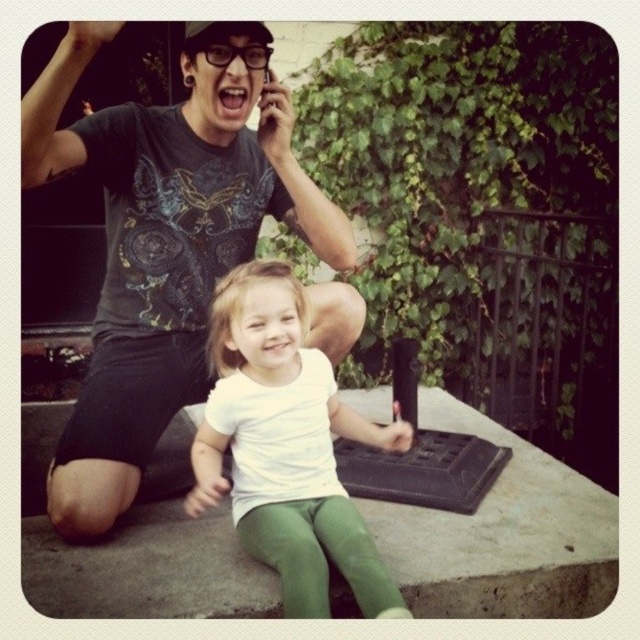
You are a photographer trying to capture a candid shot of the scene. You notice the green fabric at lower center and the white matte shirt at center. Which object should you focus on if you want to capture the subject that is positioned to the right side of the other?

The green fabric at lower center should be focused on because it is positioned to the right of the white matte shirt at center.

You are standing in a park and see a person on the left and a child on the right. You notice a specific point at coordinates point (164, 237). Based on the scene, where exactly is this point located?

The point (164, 237) is on the matte black tshirt at upper left.